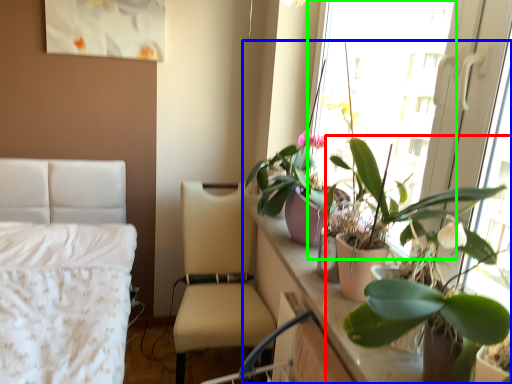
Question: Estimate the real-world distances between objects in this image. Which object is farther from houseplant (highlighted by a red box), houseplant (highlighted by a blue box) or window screen (highlighted by a green box)?

Choices:
 (A) houseplant
 (B) window screen

Answer: (B)